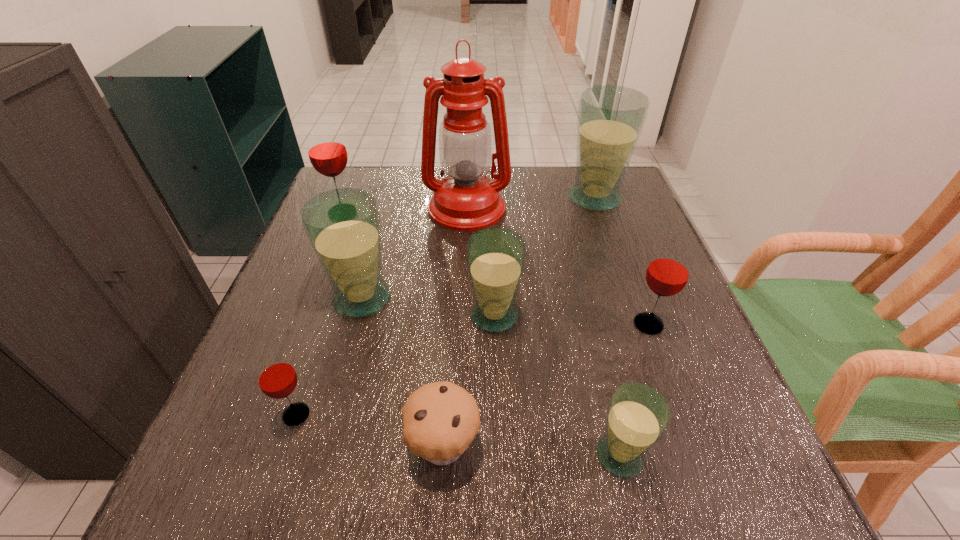
What are the coordinates of `the smallest red glass` in the screenshot? It's located at (277, 378).

Where is `the smallest blue glass`? This screenshot has height=540, width=960. the smallest blue glass is located at coordinates (637, 417).

You are a GUI agent. You are given a task and a screenshot of the screen. Output one action in this format:
    pyautogui.click(x=<x>, y=<y>)
    Task: Click on the nearest glass
    This screenshot has width=960, height=540.
    Given the screenshot: What is the action you would take?
    pyautogui.click(x=637, y=417)

Identify the location of muffin. (440, 420).

Locate an element on the screen. This screenshot has width=960, height=540. blank space located 0.050m on the left of the oil lamp is located at coordinates (405, 208).

Locate an element on the screen. free location located on the front of the tallest glass is located at coordinates (605, 227).

Find the location of a particular element. This screenshot has height=540, width=960. free space located on the front of the biggest red glass is located at coordinates click(324, 260).

Locate an element on the screen. vacant position located 0.280m on the front of the second biggest blue glass is located at coordinates (317, 465).

Image resolution: width=960 pixels, height=540 pixels. I want to click on vacant space positioned 0.110m on the back of the second smallest red glass, so click(x=630, y=274).

Identify the location of free point located on the right of the third blue glass from right to left. The height and width of the screenshot is (540, 960). (556, 316).